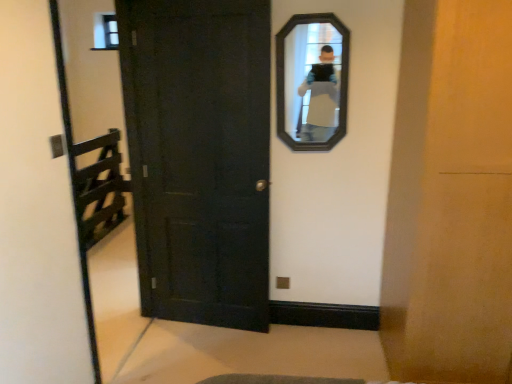
Measure the distance between black wooden mirror at upper center and camera.

black wooden mirror at upper center and camera are 2.22 meters apart from each other.

Where is `black wooden mirror at upper center`? The height and width of the screenshot is (384, 512). black wooden mirror at upper center is located at coordinates (312, 81).

What do you see at coordinates (312, 81) in the screenshot?
I see `black wooden mirror at upper center` at bounding box center [312, 81].

Image resolution: width=512 pixels, height=384 pixels. Describe the element at coordinates (199, 156) in the screenshot. I see `matte black door at center` at that location.

Based on the photo, measure the distance between matte black door at center and camera.

2.15 meters.

You are a GUI agent. You are given a task and a screenshot of the screen. Output one action in this format:
    pyautogui.click(x=<x>, y=<y>)
    Task: Click on the matte black door at center
    The image size is (512, 384).
    Given the screenshot: What is the action you would take?
    pyautogui.click(x=199, y=156)

Where is `black wooden mirror at upper center`? This screenshot has height=384, width=512. black wooden mirror at upper center is located at coordinates coord(312,81).

Would you say black wooden mirror at upper center is to the left or to the right of matte black door at center in the picture?

Clearly, black wooden mirror at upper center is on the right of matte black door at center in the image.

Which object is more forward, black wooden mirror at upper center or matte black door at center?

matte black door at center is more forward.

From the picture: Which point is more distant from viewer, (308,112) or (161,79)?

The point (308,112) is farther from the camera.

From the image's perspective, does black wooden mirror at upper center appear lower than matte black door at center?

Actually, black wooden mirror at upper center appears above matte black door at center in the image.

From a real-world perspective, is black wooden mirror at upper center under matte black door at center?

No, from a real-world perspective, black wooden mirror at upper center is not under matte black door at center.

Between black wooden mirror at upper center and matte black door at center, which one has smaller width?

black wooden mirror at upper center is thinner.

Considering the sizes of objects black wooden mirror at upper center and matte black door at center in the image provided, who is taller, black wooden mirror at upper center or matte black door at center?

matte black door at center is taller.

Considering the relative sizes of black wooden mirror at upper center and matte black door at center in the image provided, is black wooden mirror at upper center bigger than matte black door at center?

Incorrect, black wooden mirror at upper center is not larger than matte black door at center.

Is black wooden mirror at upper center inside the boundaries of matte black door at center, or outside?

The correct answer is: outside.

Is black wooden mirror at upper center not close to matte black door at center?

No, black wooden mirror at upper center is not far from matte black door at center.

Is black wooden mirror at upper center looking in the opposite direction of matte black door at center?

No, black wooden mirror at upper center is not facing the opposite direction of matte black door at center.

Measure the distance between black wooden mirror at upper center and matte black door at center.

21.96 inches.

Where is `mirror located above the matte black door at center (from a real-world perspective)`? The image size is (512, 384). mirror located above the matte black door at center (from a real-world perspective) is located at coordinates (312, 81).

In the image, is matte black door at center on the left side or the right side of black wooden mirror at upper center?

matte black door at center is positioned on black wooden mirror at upper center's left side.

Is matte black door at center closer to the viewer compared to black wooden mirror at upper center?

Yes.

Is point (205, 201) closer or farther from the camera than point (313, 85)?

Point (205, 201) is positioned farther from the camera compared to point (313, 85).

From the image's perspective, between matte black door at center and black wooden mirror at upper center, who is located below?

matte black door at center, from the image's perspective.

From a real-world perspective, relative to black wooden mirror at upper center, is matte black door at center vertically above or below?

matte black door at center is below black wooden mirror at upper center.

Between matte black door at center and black wooden mirror at upper center, which one has smaller width?

black wooden mirror at upper center.

Does matte black door at center have a lesser height compared to black wooden mirror at upper center?

In fact, matte black door at center may be taller than black wooden mirror at upper center.

In terms of size, does matte black door at center appear bigger or smaller than black wooden mirror at upper center?

In the image, matte black door at center appears to be larger than black wooden mirror at upper center.

Is matte black door at center not within black wooden mirror at upper center?

Absolutely, matte black door at center is external to black wooden mirror at upper center.

Is matte black door at center next to black wooden mirror at upper center?

No.

Is matte black door at center oriented away from black wooden mirror at upper center?

matte black door at center does not have its back to black wooden mirror at upper center.

How many degrees apart are the facing directions of matte black door at center and black wooden mirror at upper center?

6.12 degrees.

Measure the distance from matte black door at center to black wooden mirror at upper center.

The distance of matte black door at center from black wooden mirror at upper center is 21.96 inches.

This screenshot has height=384, width=512. In order to click on door in front of the black wooden mirror at upper center in this screenshot , I will do `click(199, 156)`.

Find the location of a particular element. mirror above the matte black door at center (from a real-world perspective) is located at coordinates 312,81.

Find the location of a particular element. The height and width of the screenshot is (384, 512). door that appears in front of the black wooden mirror at upper center is located at coordinates (199, 156).